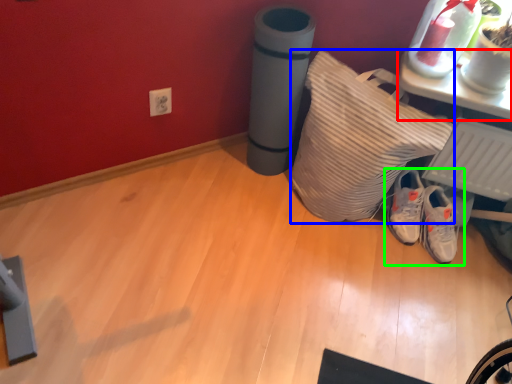
Question: Based on their relative distances, which object is farther from furniture (highlighted by a red box)? Choose from pillow (highlighted by a blue box) and footwear (highlighted by a green box).

Choices:
 (A) pillow
 (B) footwear

Answer: (B)